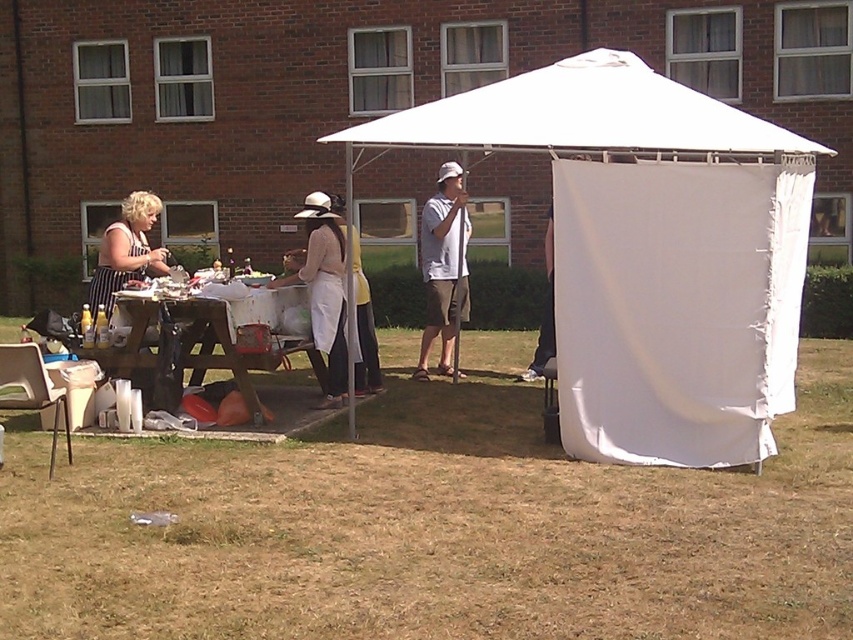
Based on the photo, does wooden picnic table at center have a larger size compared to white cotton shirt at center?

Correct, wooden picnic table at center is larger in size than white cotton shirt at center.

Does wooden picnic table at center have a lesser height compared to white cotton shirt at center?

Correct, wooden picnic table at center is not as tall as white cotton shirt at center.

What are the coordinates of `wooden picnic table at center` in the screenshot? It's located at (212, 342).

The width and height of the screenshot is (853, 640). I want to click on wooden picnic table at center, so click(212, 342).

Is wooden picnic table at center positioned behind striped apron at left?

That is False.

Which is in front, point (132, 364) or point (113, 280)?

Point (132, 364) is in front.

The width and height of the screenshot is (853, 640). What are the coordinates of `wooden picnic table at center` in the screenshot? It's located at (212, 342).

Is point (582, 141) farther from camera compared to point (149, 227)?

No.

Is white fabric canopy at center to the right of striped apron at left from the viewer's perspective?

Correct, you'll find white fabric canopy at center to the right of striped apron at left.

Measure the distance between point [457,102] and camera.

Point [457,102] and camera are 9.58 meters apart from each other.

Where is `white fabric canopy at center`? white fabric canopy at center is located at coordinates tap(579, 115).